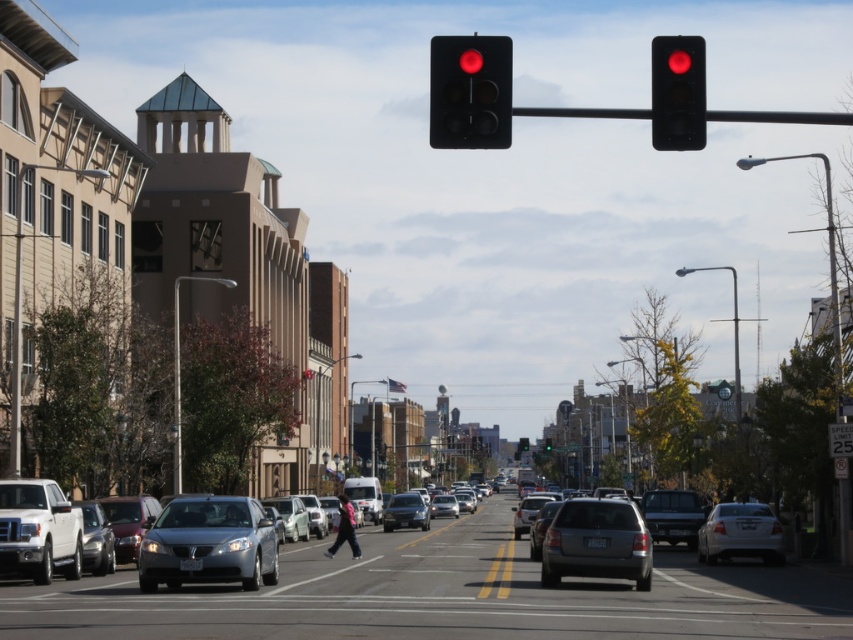
Between point (525, 436) and point (544, 444), which one is positioned behind?

Positioned behind is point (525, 436).

Does green glass traffic light at center appear on the left side of green glass traffic light at upper center?

In fact, green glass traffic light at center is to the right of green glass traffic light at upper center.

Describe the element at coordinates (521, 444) in the screenshot. I see `green glass traffic light at center` at that location.

Identify the location of green glass traffic light at center. (521, 444).

Who is positioned more to the left, matte black truck at center or green glass traffic light at upper center?

matte black truck at center is more to the left.

Is point (664, 525) less distant than point (549, 449)?

Yes, point (664, 525) is in front of point (549, 449).

This screenshot has height=640, width=853. I want to click on matte black truck at center, so click(x=672, y=515).

Is satin silver sedan at lower left smaller than green glass traffic light at upper center?

Yes.

Is point (155, 570) farther from viewer compared to point (550, 436)?

No.

The height and width of the screenshot is (640, 853). I want to click on satin silver sedan at lower left, so click(x=209, y=544).